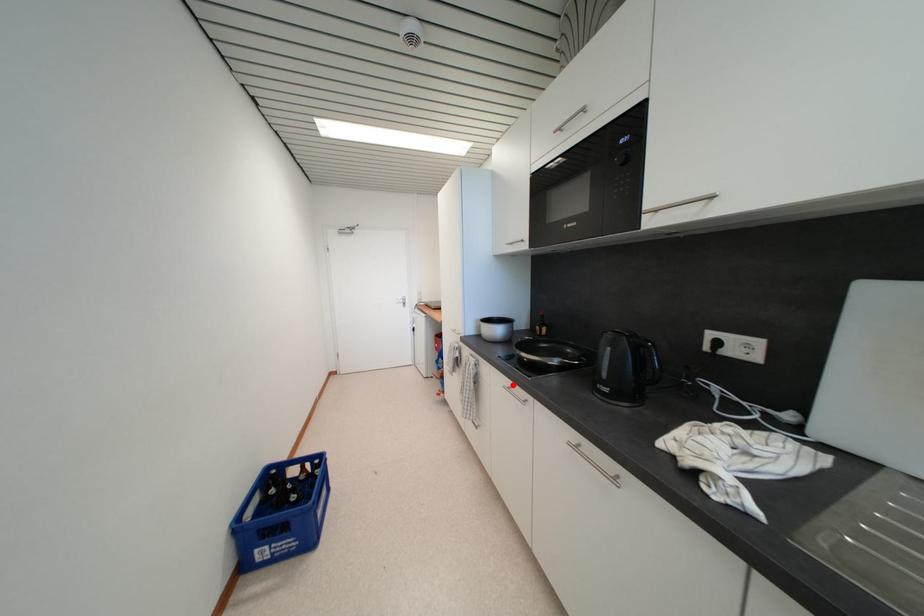
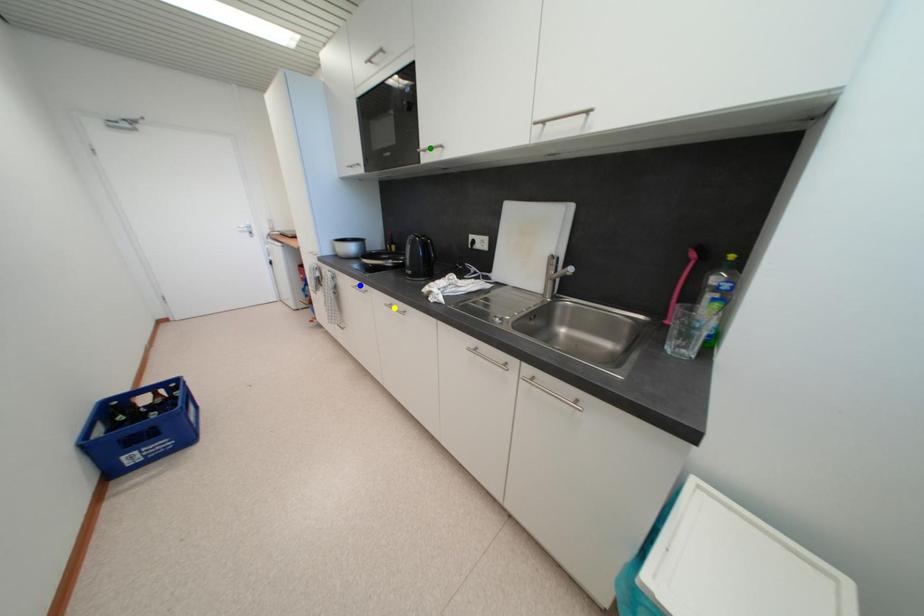
Question: I am providing you with two images of the same scene from different viewpoints. A red point is marked on the first image. You are given multiple points on the second image. Which spot in image 2 lines up with the point in image 1?

Choices:
 (A) green point
 (B) blue point
 (C) yellow point

Answer: (B)